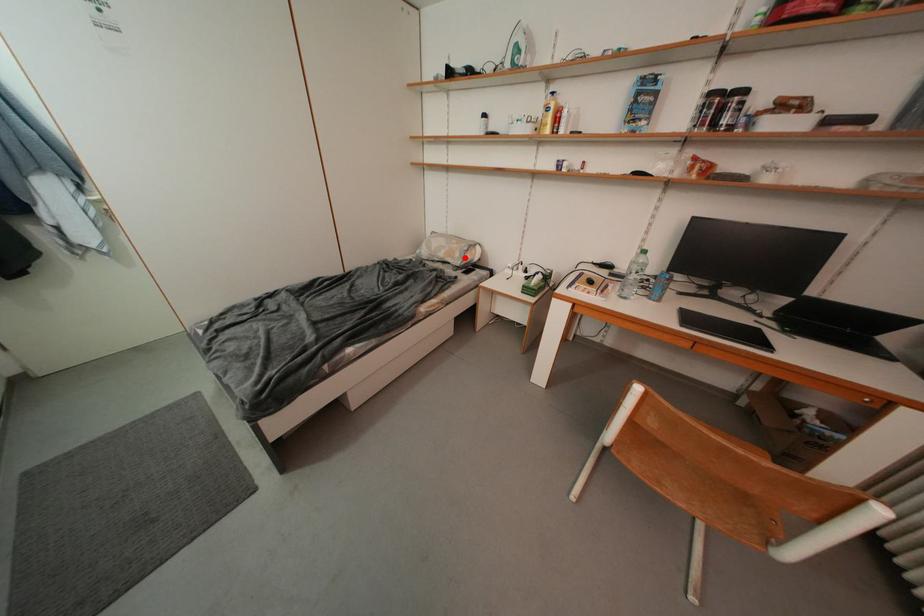
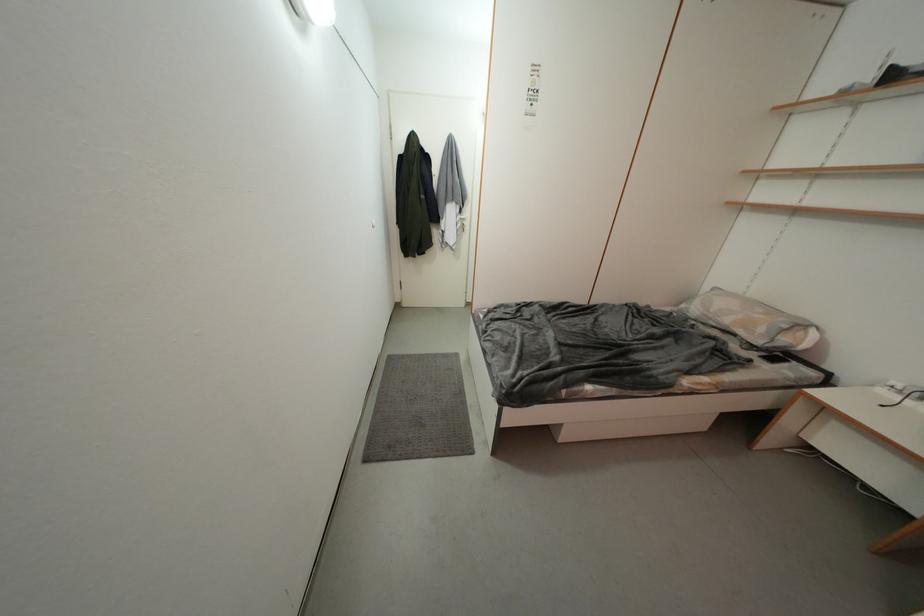
Question: I am providing you with two images of the same scene from different viewpoints. In image1, a red point is highlighted. Considering the same 3D point in image2, which of the following is correct?

Choices:
 (A) It is closer
 (B) It is farther

Answer: (B)